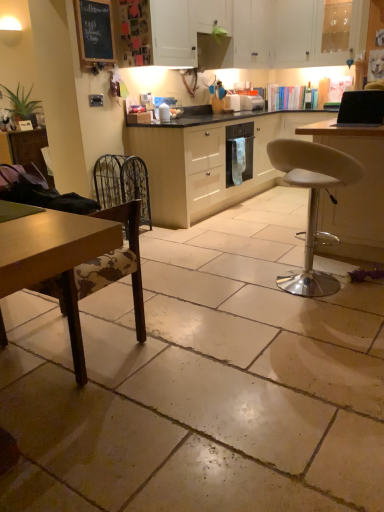
Identify the location of vacant space in front of white leather stool at center-right, which is the first chair from right to left. (315, 323).